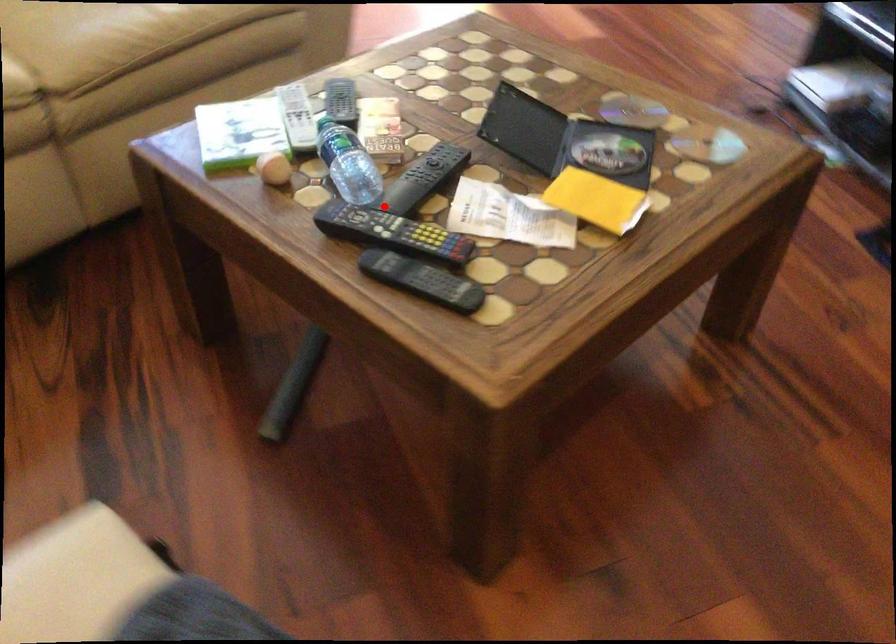
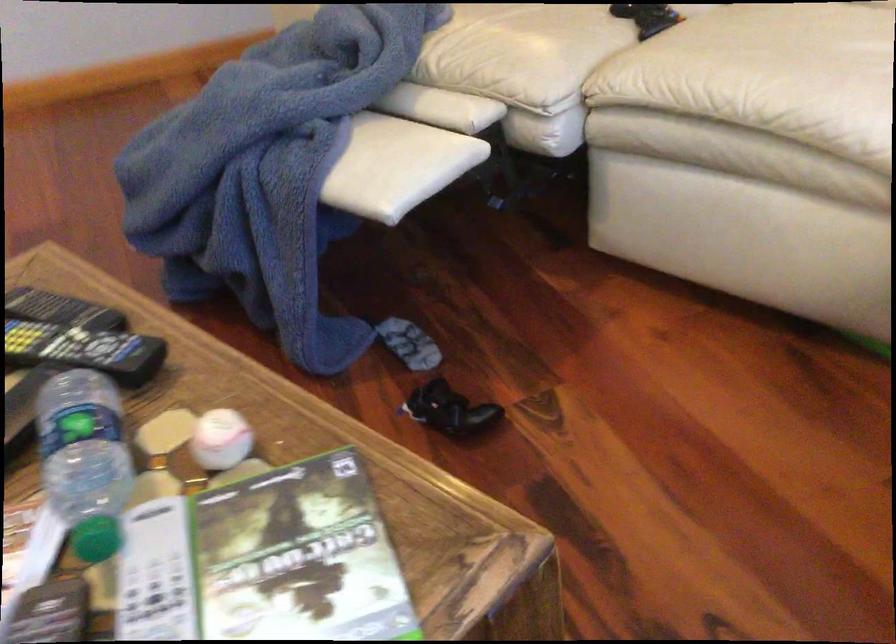
Find the pixel in the second image that matches the highlighted location in the first image.

(84, 350)